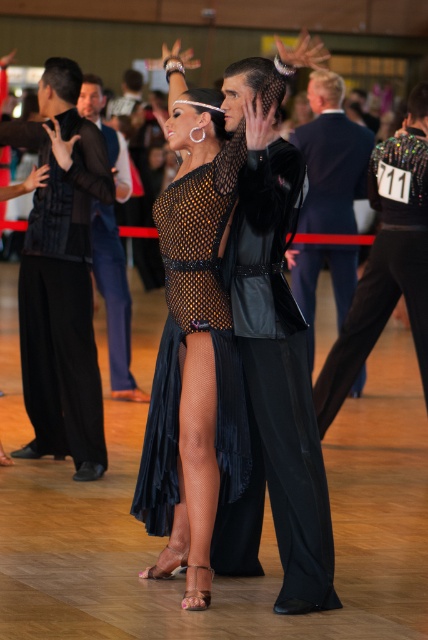
In the ballroom dance scene, there are two formal outfits visible. The first is the black velvet vest at left, and the second is the velvet black suit at center. From the perspective of someone standing in the ballroom facing the dancers, which outfit is positioned more to the left?

The black velvet vest at left is positioned more to the left than the velvet black suit at center.

You are standing at the point marked as point (220, 205) in the image. The ballroom dance competition is currently happening. You need to move to the center of the dance floor to join the next dance. Considering the current positions of the dancers, is the path from your current position to the center of the dance floor clear?

The path from point (220, 205) to the center of the dance floor is clear because the dancers are 16.16 feet apart, indicating sufficient space for movement.

From the picture: You are a photographer at the ballroom event and need to capture both the velvet suit at right and the velvet suit at center in a single frame. Since you want both to be clearly visible, which velvet suit should you focus on to ensure the larger one is in focus?

The velvet suit at right is larger than the velvet suit at center. To ensure the larger one is in focus, you should focus on the velvet suit at right.